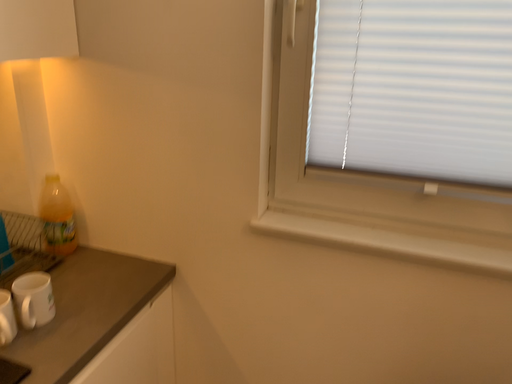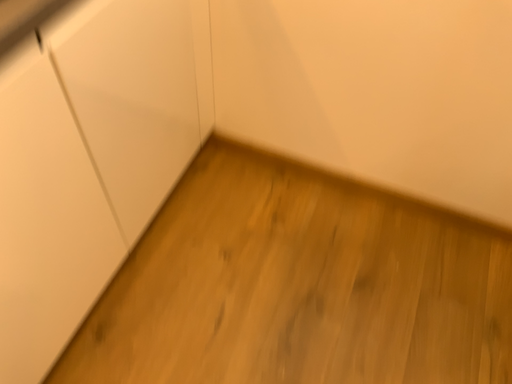
Question: How did the camera likely rotate when shooting the video?

Choices:
 (A) rotated downward
 (B) rotated upward

Answer: (A)